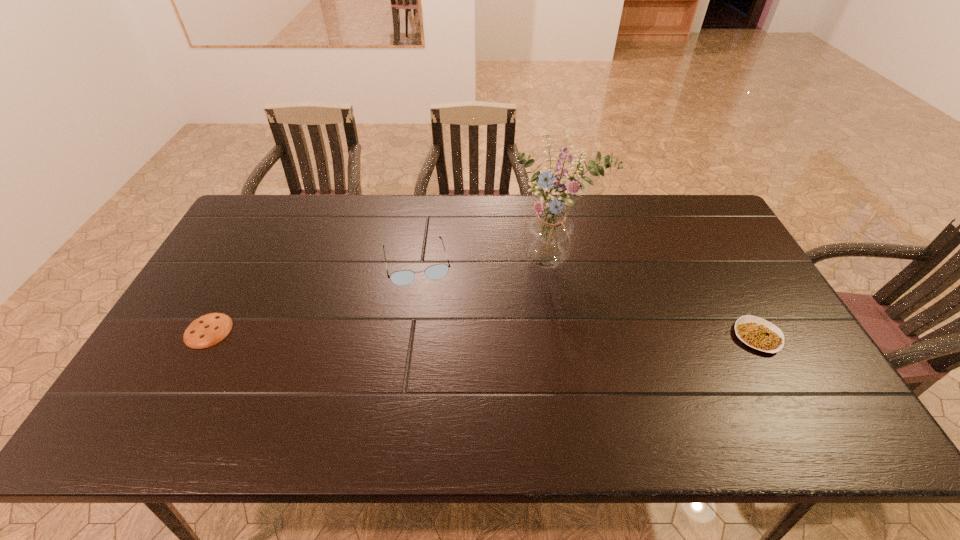
I want to click on cookie, so click(x=208, y=330).

Find the location of a particular element. the shortest object is located at coordinates (208, 330).

Find the location of a particular element. legume is located at coordinates (759, 334).

At what (x,y) coordinates should I click in order to perform the action: click on the second shortest object. Please return your answer as a coordinate pair (x, y). Looking at the image, I should click on [x=759, y=334].

This screenshot has width=960, height=540. In order to click on the second tallest object in this screenshot , I will do `click(401, 278)`.

Identify the location of spectacles. (401, 278).

You are a GUI agent. You are given a task and a screenshot of the screen. Output one action in this format:
    pyautogui.click(x=<x>, y=<y>)
    Task: Click on the tallest object
    The height and width of the screenshot is (540, 960).
    Given the screenshot: What is the action you would take?
    pyautogui.click(x=549, y=234)

The width and height of the screenshot is (960, 540). Identify the location of the third object from left to right. (549, 234).

Identify the location of vacant position located on the front of the leftmost object. (183, 376).

Where is `vacant area situated 0.230m on the left of the rightmost object`? This screenshot has width=960, height=540. vacant area situated 0.230m on the left of the rightmost object is located at coordinates (647, 336).